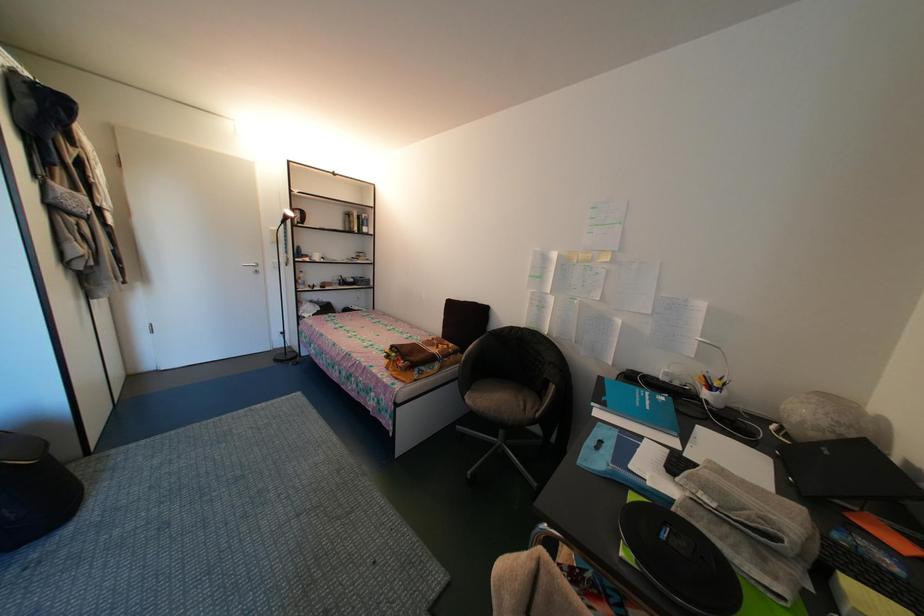
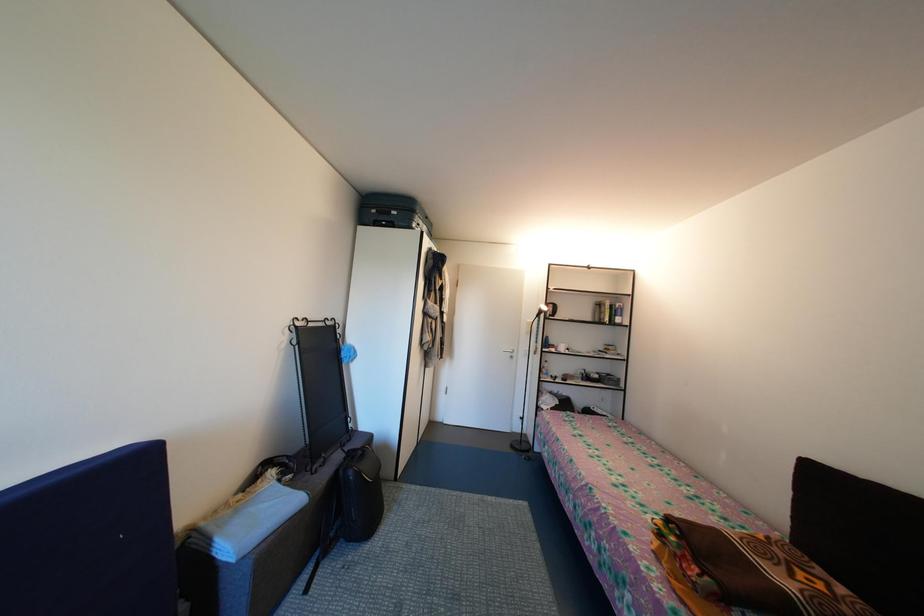
Question: The images are taken continuously from a first-person perspective. In which direction is your viewpoint rotating?

Choices:
 (A) Left
 (B) Right
 (C) Up
 (D) Down

Answer: (A)